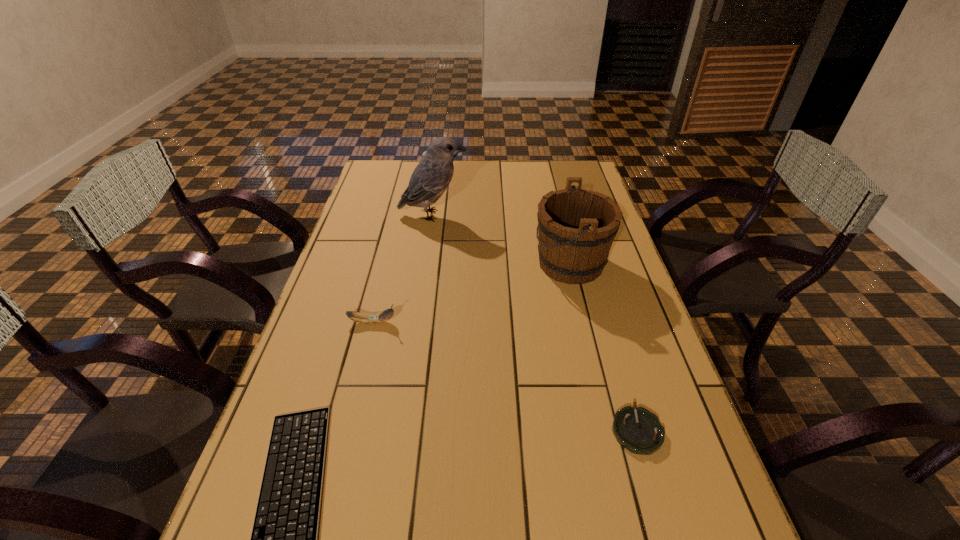
Locate an element on the screen. The height and width of the screenshot is (540, 960). ashtray positioned at the right edge is located at coordinates (638, 430).

This screenshot has height=540, width=960. What are the coordinates of `free region at the far edge of the desktop` in the screenshot? It's located at (509, 165).

Identify the location of vacant area at the left edge of the desktop. (330, 387).

The image size is (960, 540). In the image, there is a desktop. Find the location of `vacant space at the right edge`. vacant space at the right edge is located at coordinates (621, 408).

The height and width of the screenshot is (540, 960). In the image, there is a desktop. In order to click on free region at the far left corner in this screenshot , I will do `click(376, 165)`.

Locate an element on the screen. free space between the wine bucket and the farthest object is located at coordinates (501, 220).

Where is `unoccupied area between the third farthest object and the banana`? The width and height of the screenshot is (960, 540). unoccupied area between the third farthest object and the banana is located at coordinates (471, 293).

Locate an element on the screen. unoccupied area between the farthest object and the fifth tallest object is located at coordinates (535, 303).

The width and height of the screenshot is (960, 540). In order to click on free space between the wine bucket and the parrot in this screenshot , I will do `click(502, 239)`.

Locate which object ranks fifth in proximity to the wine bucket. Please provide its 2D coordinates. Your answer should be formatted as a tuple, i.e. [(x, y)], where the tuple contains the x and y coordinates of a point satisfying the conditions above.

[(284, 536)]